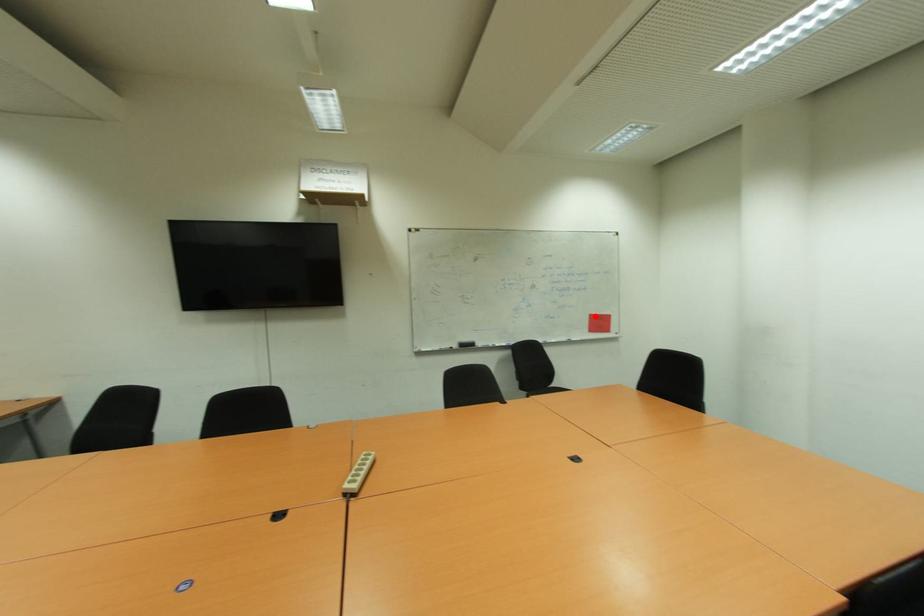
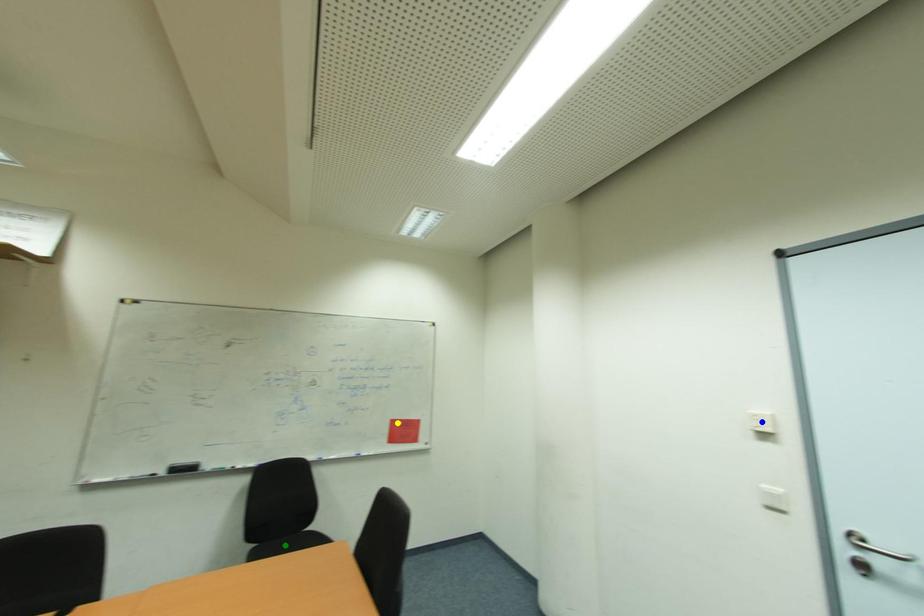
Question: I am providing you with two images of the same scene from different viewpoints. A red point is marked on the first image. You are given multiple points on the second image. Which point in image 2 represents the same 3d spot as the red point in image 1?

Choices:
 (A) blue point
 (B) green point
 (C) yellow point

Answer: (C)